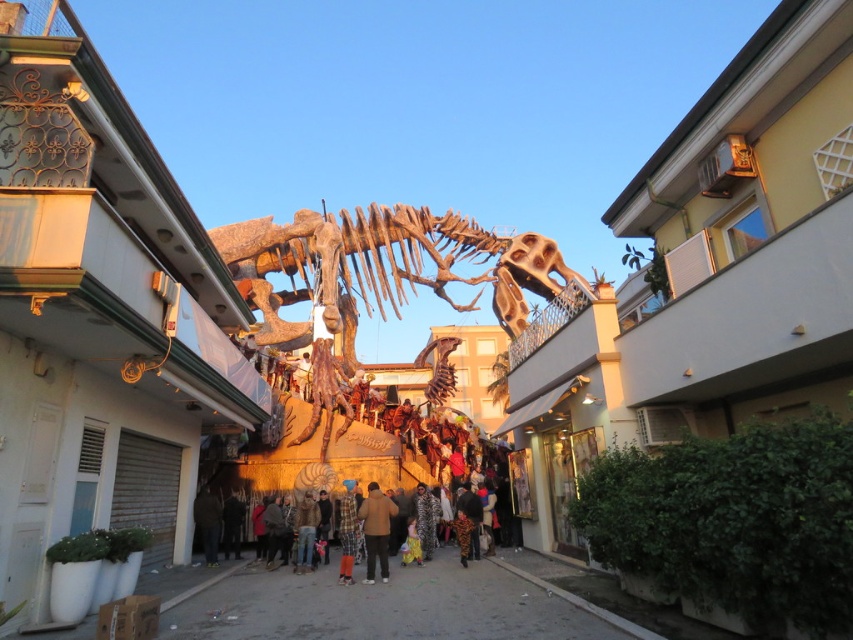
Question: From the image, what is the correct spatial relationship of rustic wood dinosaur at center in relation to dark brown leather jacket at center?

Choices:
 (A) right
 (B) left

Answer: (A)

Question: Which of the following is the farthest from the observer?

Choices:
 (A) (347, 516)
 (B) (402, 474)
 (C) (283, 268)

Answer: (C)

Question: Among these objects, which one is farthest from the camera?

Choices:
 (A) rustic wood dinosaur at center
 (B) brown fabric pants at center
 (C) camouflage-patterned jacket at center
 (D) jeans at center

Answer: (C)

Question: Does camouflage-patterned jacket at center have a lesser width compared to jeans at center?

Choices:
 (A) yes
 (B) no

Answer: (B)

Question: Is camouflage-patterned pants at center thinner than dark brown leather jacket at center?

Choices:
 (A) yes
 (B) no

Answer: (A)

Question: Based on their relative distances, which object is nearer to the rustic wood dinosaur at center?

Choices:
 (A) dark brown leather jacket at center
 (B) dark brown fabric at lower center
 (C) camouflage-patterned pants at center
 (D) jeans at center

Answer: (D)